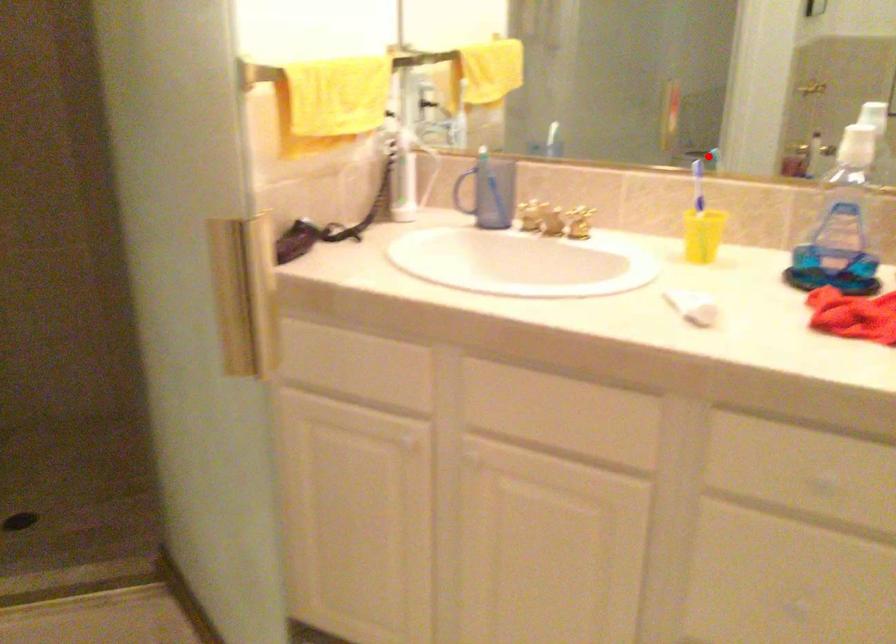
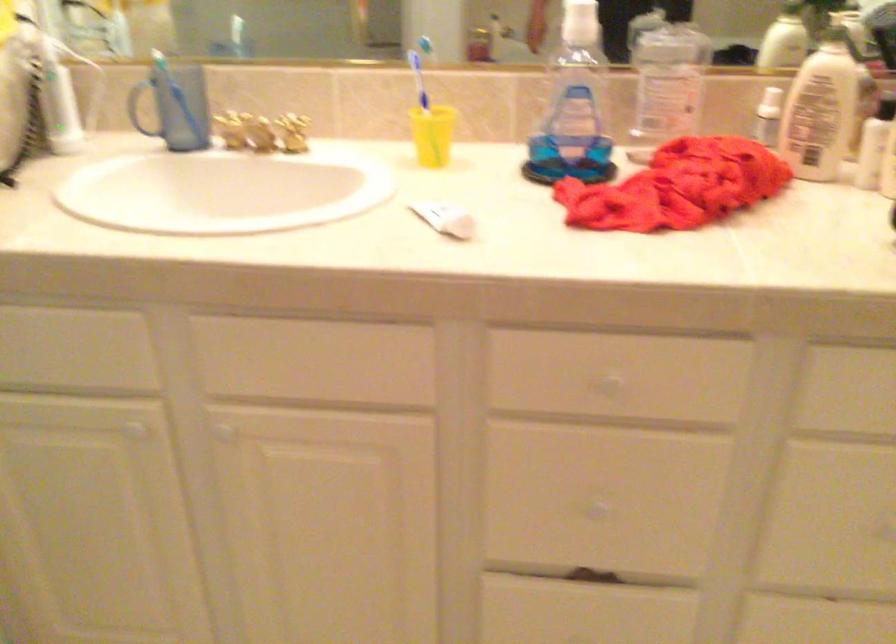
In the second image, find the point that corresponds to the highlighted location in the first image.

(426, 46)